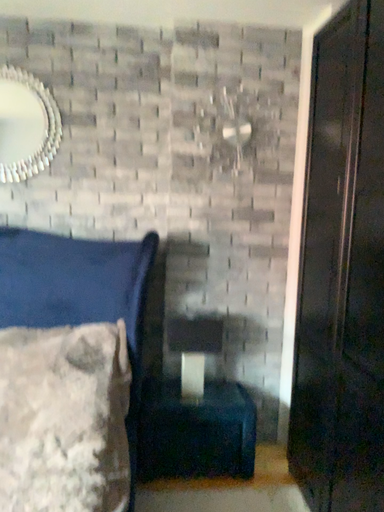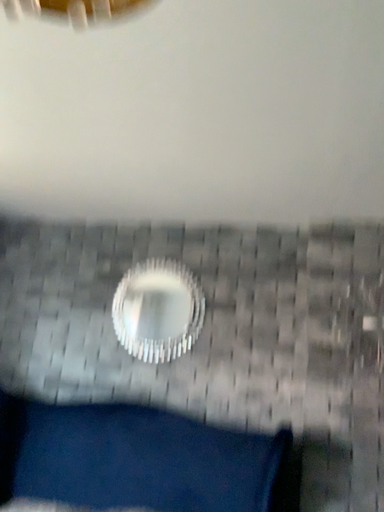
Question: How did the camera likely rotate when shooting the video?

Choices:
 (A) rotated left
 (B) rotated right

Answer: (A)